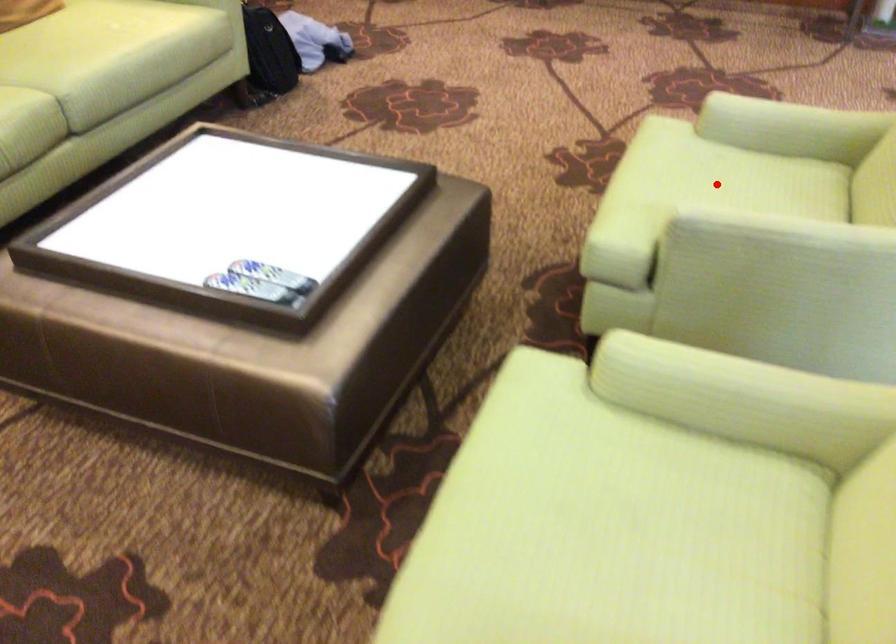
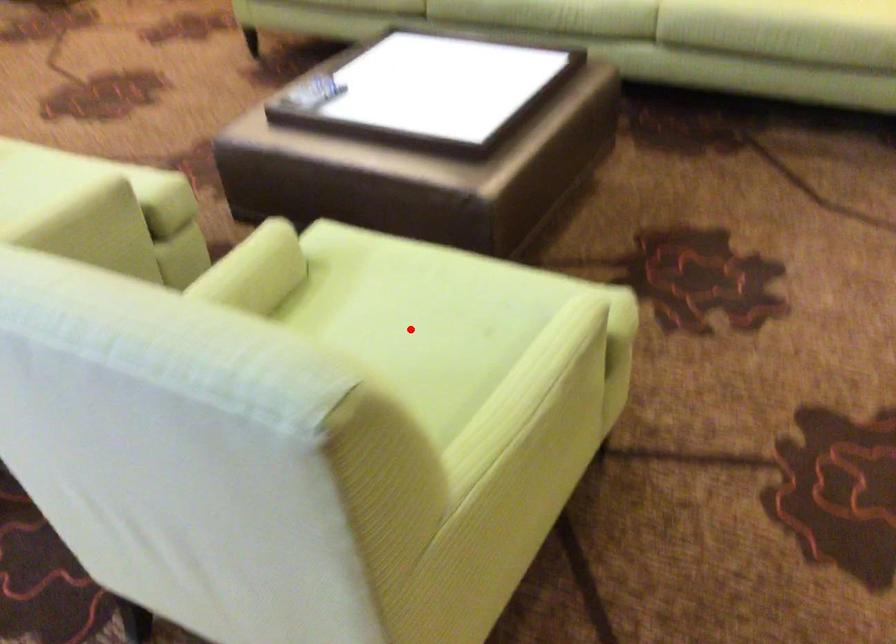
I am providing you with two images of the same scene from different viewpoints. A red point is marked on the first image and another point is marked on the second image. Do the highlighted points in image1 and image2 indicate the same real-world spot?

Yes